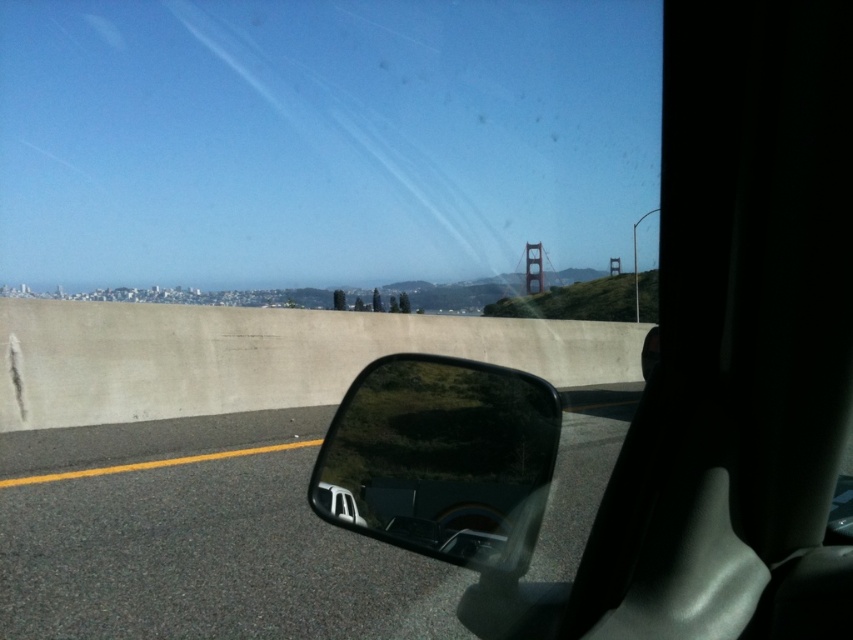
Question: Where is black glossy mirror at lower right located in relation to transparent glass mirror at center in the image?

Choices:
 (A) above
 (B) below

Answer: (B)

Question: Which is nearer to the transparent glass mirror at center?

Choices:
 (A) golden gate bridge at upper right
 (B) black glossy mirror at lower right

Answer: (B)

Question: Can you confirm if transparent glass mirror at center is positioned below golden gate bridge at upper right?

Choices:
 (A) yes
 (B) no

Answer: (A)

Question: Among these objects, which one is nearest to the camera?

Choices:
 (A) black glossy mirror at lower right
 (B) golden gate bridge at upper right

Answer: (A)

Question: Does black glossy mirror at lower right have a lesser width compared to transparent glass mirror at center?

Choices:
 (A) no
 (B) yes

Answer: (A)

Question: Which object appears farthest from the camera in this image?

Choices:
 (A) transparent glass mirror at center
 (B) black glossy mirror at lower right

Answer: (B)